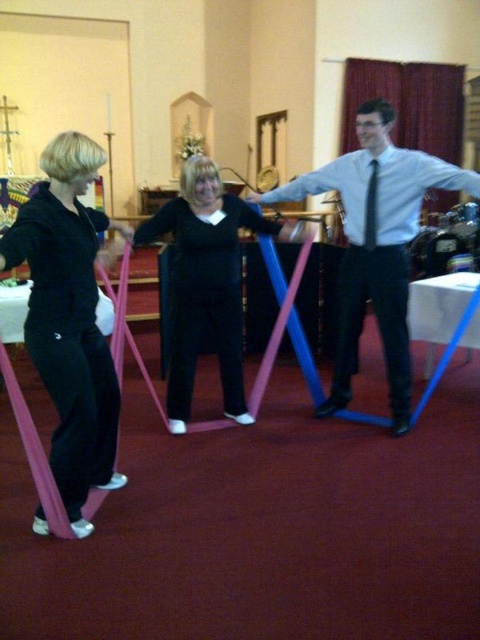
Is point (225, 397) positioned before point (372, 227)?

No, (225, 397) is behind (372, 227).

Which of these two, black matte leggings at center or black satin tie at center, stands taller?

black matte leggings at center

Between point (208, 243) and point (369, 204), which one is positioned in front?

Point (208, 243) is in front.

This screenshot has width=480, height=640. I want to click on black matte leggings at center, so click(x=204, y=284).

Does matte blue tie at center have a lesser height compared to black matte leggings at center?

In fact, matte blue tie at center may be taller than black matte leggings at center.

Does point (283, 195) come farther from viewer compared to point (192, 289)?

Yes, it is.

At what (x,y) coordinates should I click in order to perform the action: click on matte blue tie at center. Please return your answer as a coordinate pair (x, y). Looking at the image, I should click on (375, 246).

The width and height of the screenshot is (480, 640). Describe the element at coordinates (70, 320) in the screenshot. I see `black matte pants at left` at that location.

Is black matte pants at left above black matte leggings at center?

Actually, black matte pants at left is below black matte leggings at center.

What do you see at coordinates (70, 320) in the screenshot? The image size is (480, 640). I see `black matte pants at left` at bounding box center [70, 320].

Find the location of a particular element. The width and height of the screenshot is (480, 640). black matte pants at left is located at coordinates (70, 320).